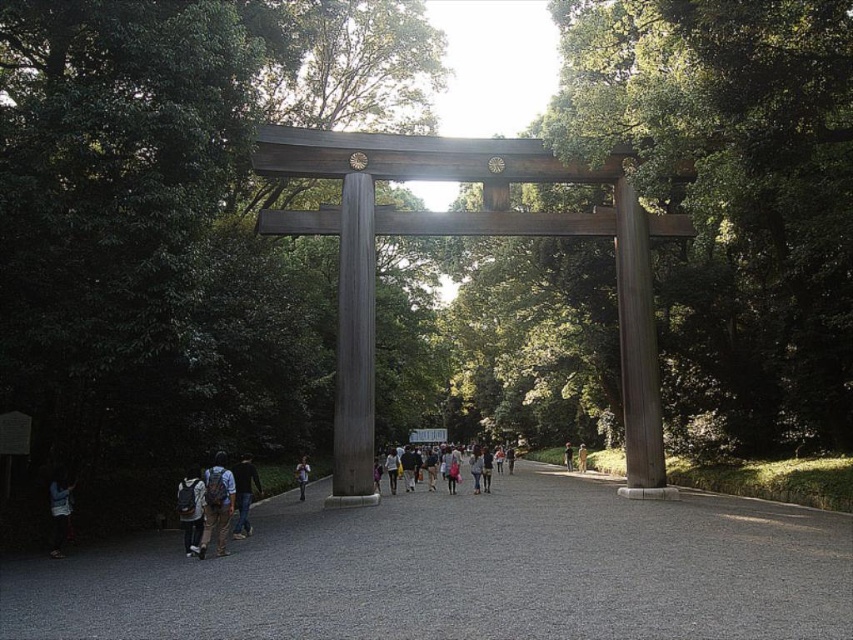
Question: Does gray asphalt path at center have a lesser width compared to matte brown backpack at lower left?

Choices:
 (A) no
 (B) yes

Answer: (A)

Question: Which point is farther from the camera taking this photo?

Choices:
 (A) (408, 486)
 (B) (566, 451)
 (C) (579, 465)

Answer: (B)

Question: Which of the following is the farthest from the observer?

Choices:
 (A) (503, 499)
 (B) (564, 456)
 (C) (239, 502)

Answer: (B)

Question: Is gray asphalt path at center wider than brown leather jacket at center?

Choices:
 (A) no
 (B) yes

Answer: (B)

Question: Does matte black backpack at center appear over denim jeans at center?

Choices:
 (A) no
 (B) yes

Answer: (A)

Question: Which point is closer to the camera taking this photo?

Choices:
 (A) (189, 522)
 (B) (50, 540)

Answer: (A)